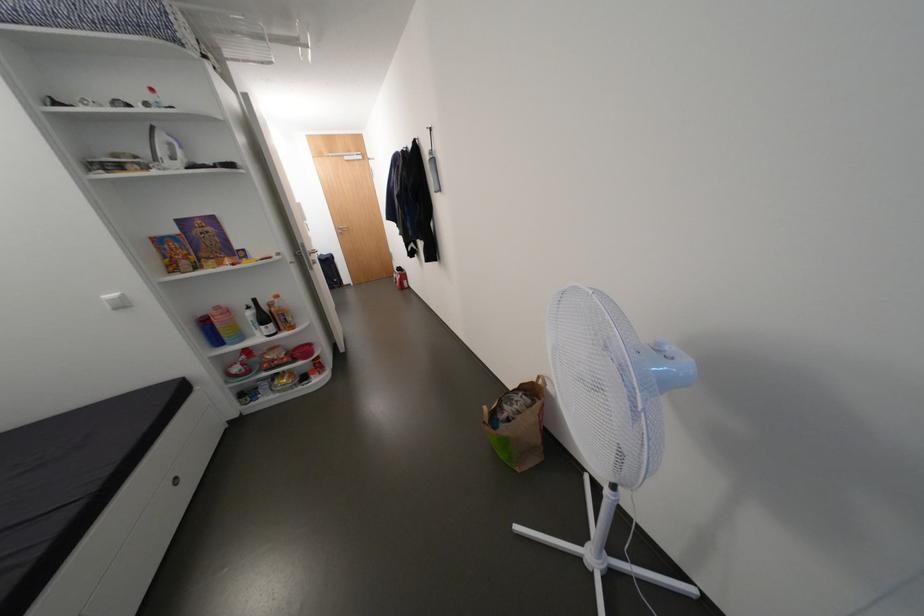
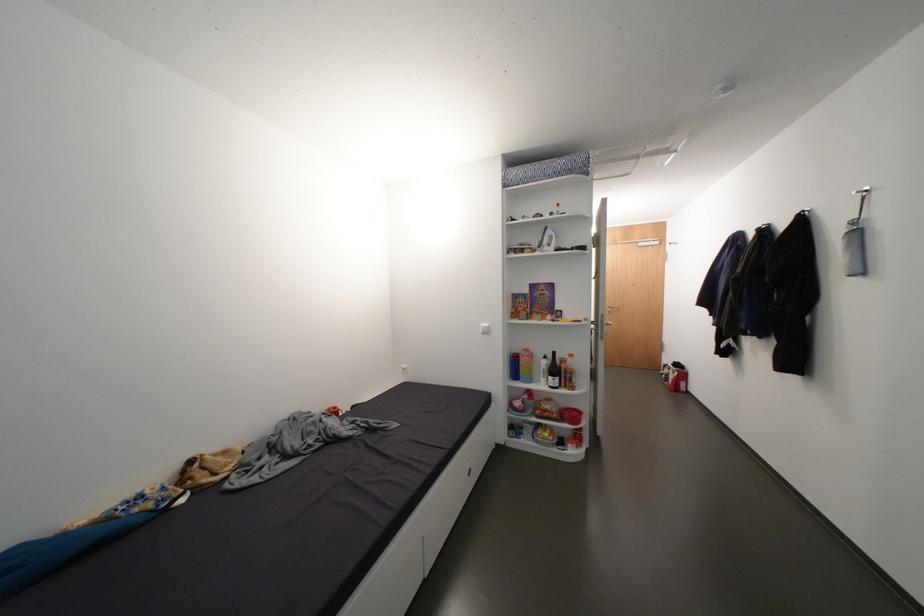
Where in the second image is the point corresponding to (281,310) from the first image?

(570, 367)